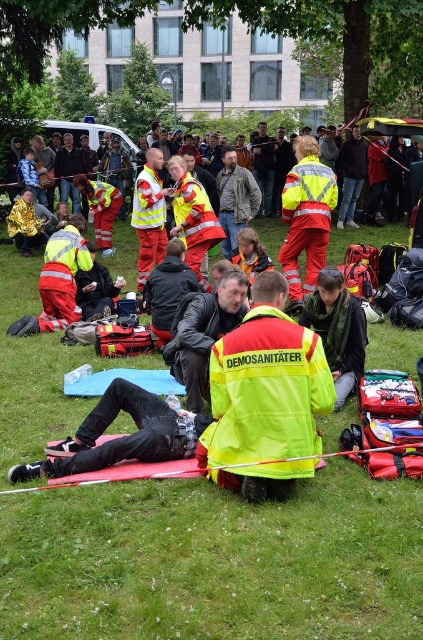
How distant is high-visibility reflective jacket at center from leather jacket at center?

high-visibility reflective jacket at center is 6.95 meters away from leather jacket at center.

Is high-visibility reflective jacket at center taller than leather jacket at center?

No, high-visibility reflective jacket at center is not taller than leather jacket at center.

Locate an element on the screen. This screenshot has height=640, width=423. high-visibility reflective jacket at center is located at coordinates (266, 397).

Does green grass at center have a lesser width compared to leather jacket at center?

No, green grass at center is not thinner than leather jacket at center.

Consider the image. Is green grass at center wider than leather jacket at center?

Correct, the width of green grass at center exceeds that of leather jacket at center.

Is point (387, 500) closer to camera compared to point (233, 170)?

Yes, point (387, 500) is closer to viewer.

Locate an element on the screen. Image resolution: width=423 pixels, height=640 pixels. green grass at center is located at coordinates (214, 561).

Can you confirm if green grass at center is bigger than high-visibility reflective jacket at center?

Yes.

What do you see at coordinates (214, 561) in the screenshot? The height and width of the screenshot is (640, 423). I see `green grass at center` at bounding box center [214, 561].

Between point (346, 598) and point (315, 400), which one is positioned in front?

Point (346, 598) is in front.

The height and width of the screenshot is (640, 423). I want to click on green grass at center, so click(214, 561).